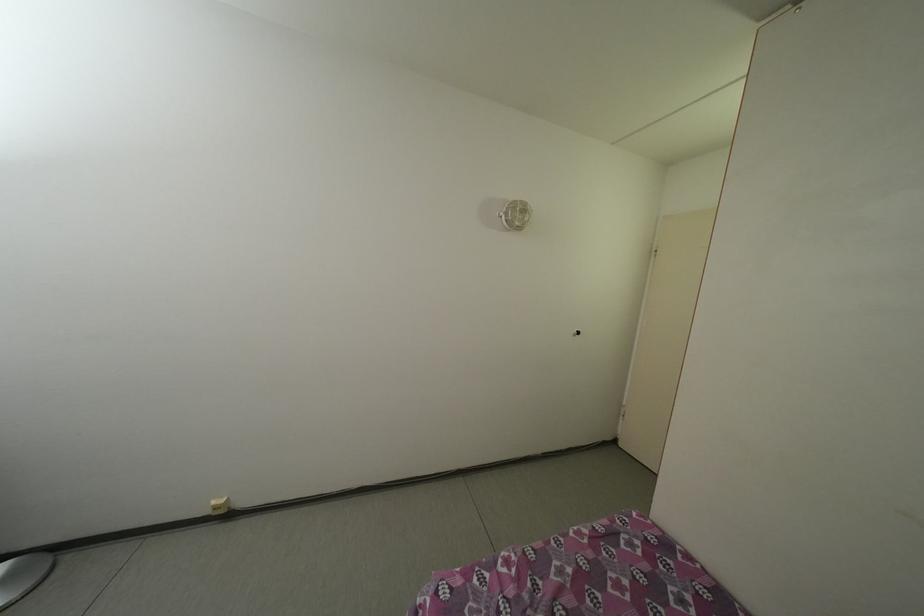
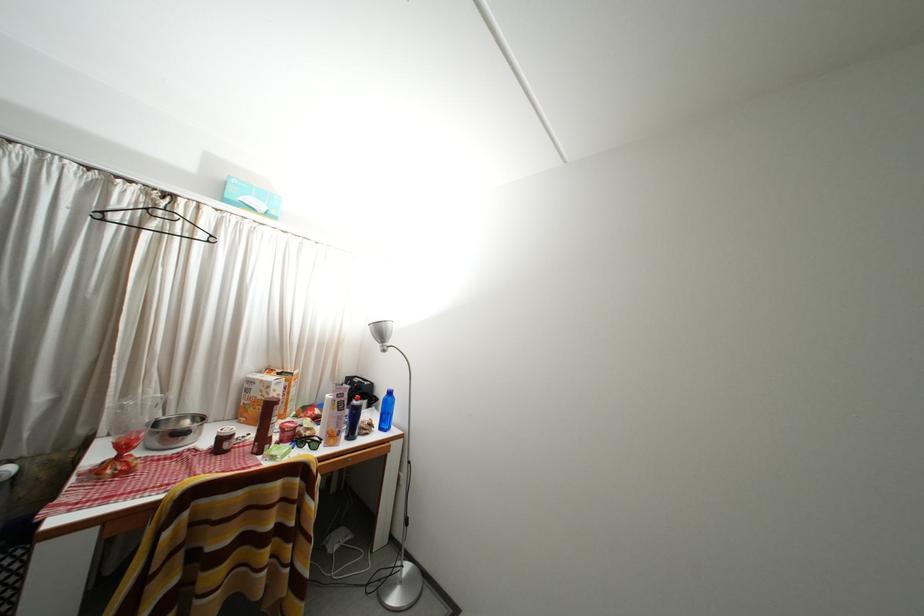
Question: How did the camera likely rotate?

Choices:
 (A) Left
 (B) Right
 (C) Up
 (D) Down

Answer: (A)